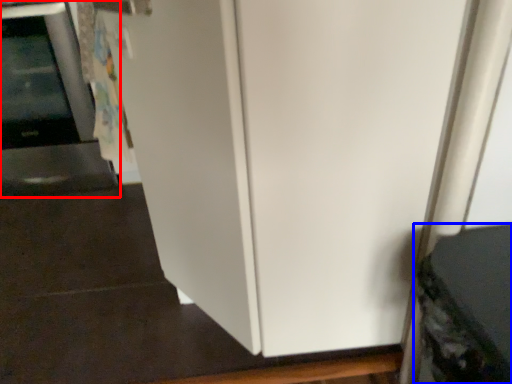
Question: Which object is closer to the camera taking this photo, appliance (highlighted by a red box) or appliance (highlighted by a blue box)?

Choices:
 (A) appliance
 (B) appliance

Answer: (B)